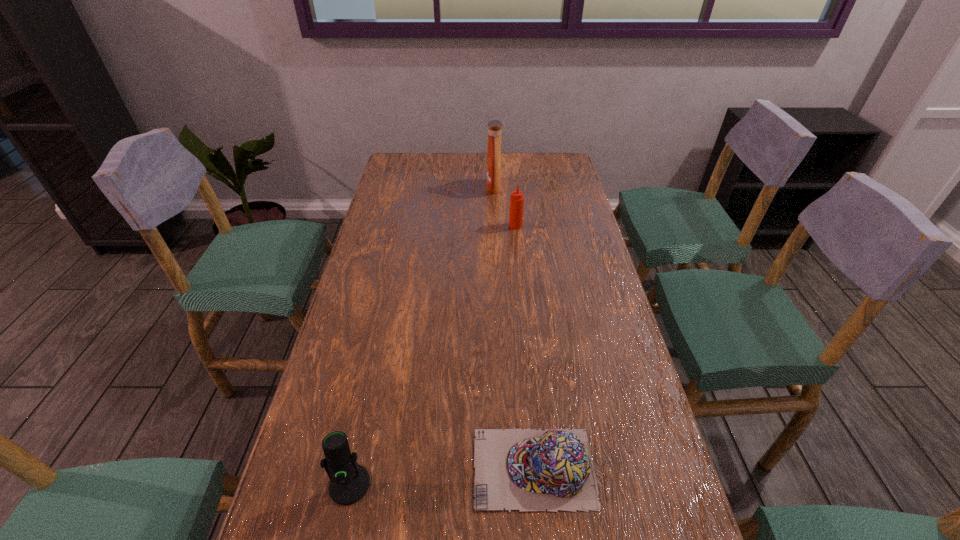
In order to click on vacant point located between the cap and the tallest object in this screenshot , I will do `click(514, 328)`.

You are a GUI agent. You are given a task and a screenshot of the screen. Output one action in this format:
    pyautogui.click(x=<x>, y=<y>)
    Task: Click on the vacant point located between the shortest object and the detergent
    
    Given the screenshot: What is the action you would take?
    pyautogui.click(x=514, y=328)

Locate an element on the screen. free spot between the farthest object and the shortest object is located at coordinates (514, 328).

Locate an element on the screen. This screenshot has height=540, width=960. unoccupied position between the second farthest object and the shortest object is located at coordinates pos(524,347).

Locate an element on the screen. The height and width of the screenshot is (540, 960). vacant space that is in between the Tabasco sauce and the microphone is located at coordinates (432, 355).

Where is `empty space between the detergent and the microphone`? The image size is (960, 540). empty space between the detergent and the microphone is located at coordinates pos(421,336).

Where is `unoccupied position between the shortest object and the third nearest object`? This screenshot has height=540, width=960. unoccupied position between the shortest object and the third nearest object is located at coordinates (524, 347).

This screenshot has width=960, height=540. I want to click on vacant region between the cap and the Tabasco sauce, so click(x=524, y=347).

The image size is (960, 540). What are the coordinates of `empty location between the second farthest object and the microphone` in the screenshot? It's located at (432, 355).

Identify the location of vacant area that lies between the cap and the tallest object. (514, 328).